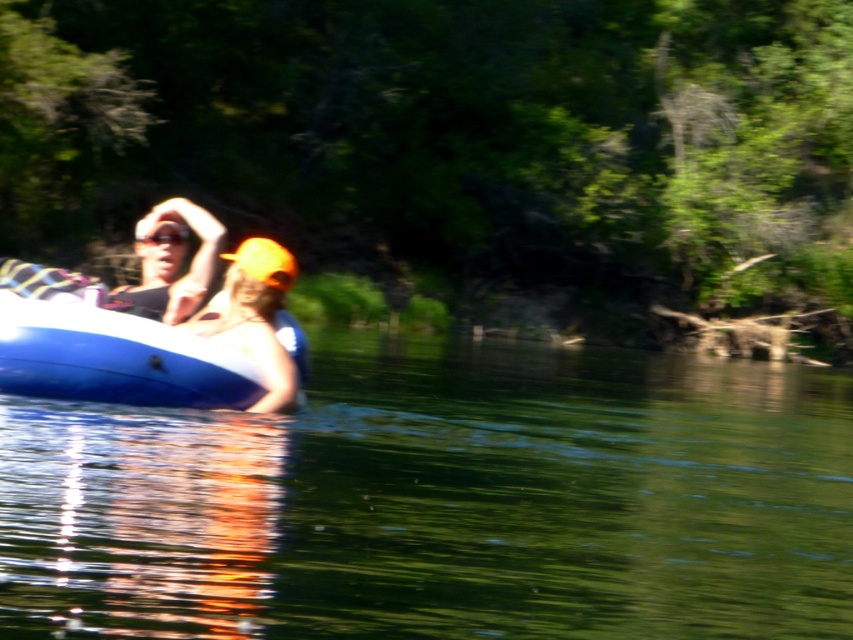
Question: Which point is closer to the camera?

Choices:
 (A) matte orange cap at left
 (B) blue rubber boat at left
 (C) green smooth water at center
 (D) orange fabric cap at center

Answer: (C)

Question: Which object appears farthest from the camera in this image?

Choices:
 (A) orange fabric cap at center
 (B) matte orange cap at left
 (C) blue rubber boat at left

Answer: (B)

Question: Is green smooth water at center thinner than blue rubber boat at left?

Choices:
 (A) yes
 (B) no

Answer: (B)

Question: Which object is farther from the camera taking this photo?

Choices:
 (A) orange fabric cap at center
 (B) matte orange cap at left
 (C) green smooth water at center
 (D) blue rubber boat at left

Answer: (B)

Question: Is orange fabric cap at center wider than matte orange cap at left?

Choices:
 (A) no
 (B) yes

Answer: (A)

Question: Is blue rubber boat at left above matte orange cap at left?

Choices:
 (A) yes
 (B) no

Answer: (B)